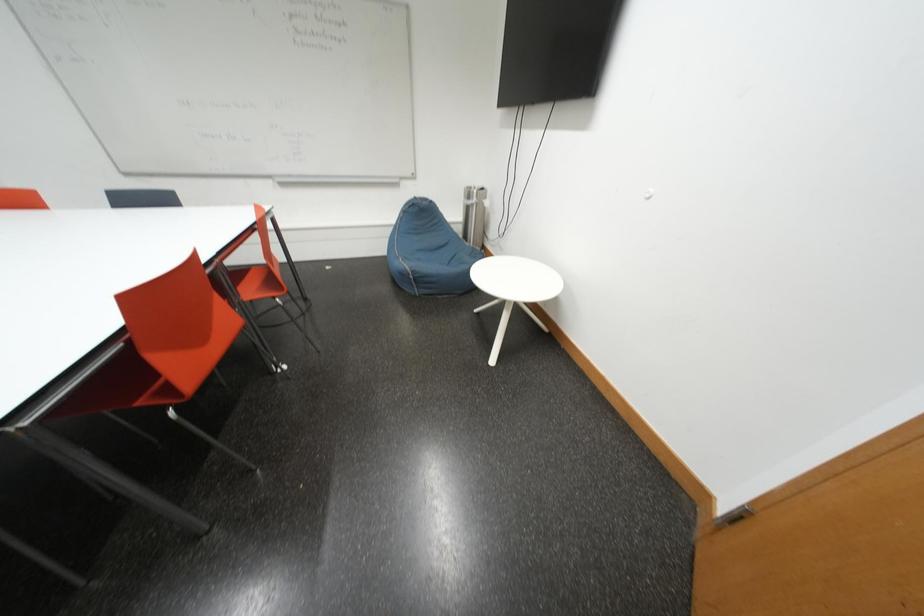
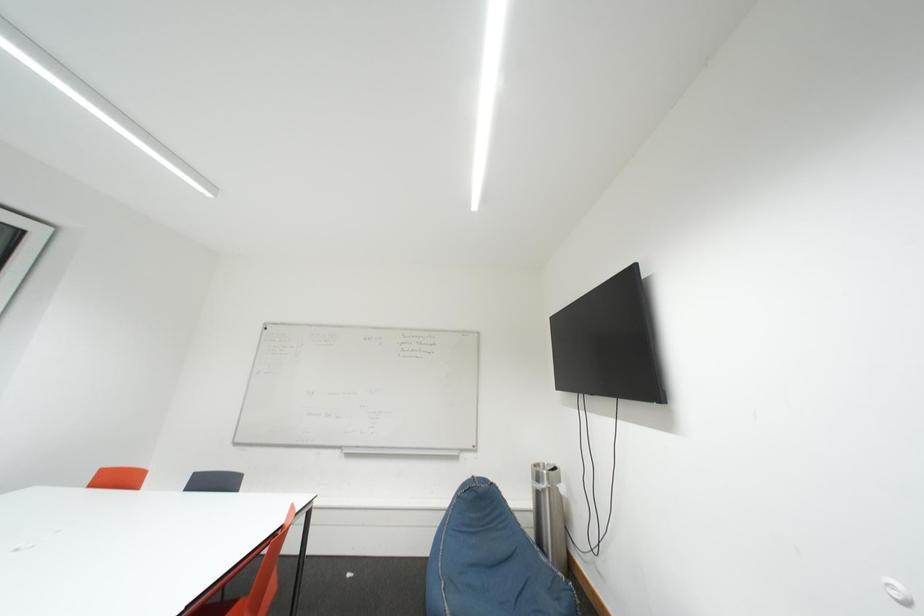
First-person continuous shooting, in which direction is the camera rotating?

The camera's rotation is toward left-up.